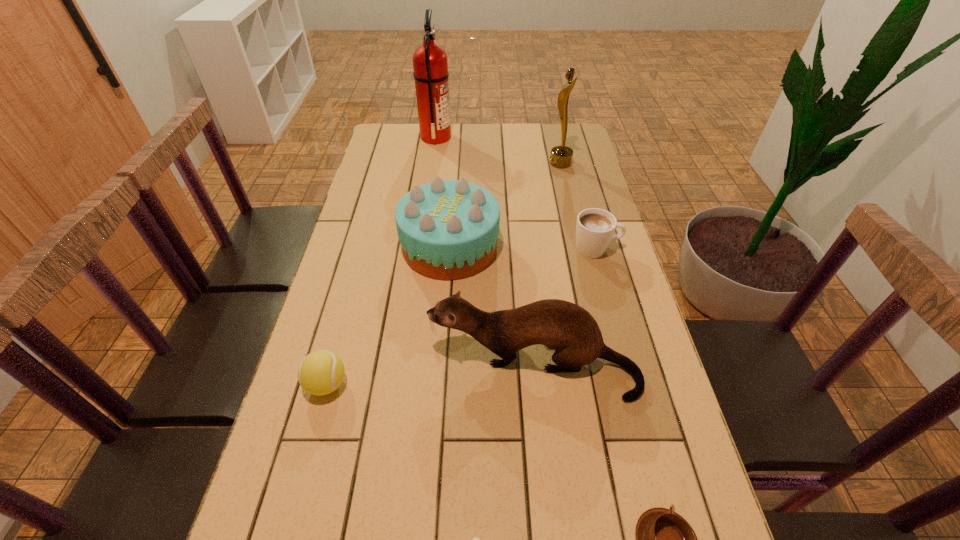
The width and height of the screenshot is (960, 540). Find the location of `free point located at the nozzle of the farthest object`. free point located at the nozzle of the farthest object is located at coordinates (541, 137).

Identify the location of free spot located 0.090m on the front-facing side of the seventh nearest object. (525, 163).

The image size is (960, 540). Find the location of `free location located on the front-facing side of the seventh nearest object`. free location located on the front-facing side of the seventh nearest object is located at coordinates (488, 163).

Locate an element on the screen. Image resolution: width=960 pixels, height=540 pixels. vacant space positioned on the front-facing side of the seventh nearest object is located at coordinates (509, 163).

At what (x,y) coordinates should I click in order to perform the action: click on vacant space located 0.150m on the back of the cake. Please return your answer as a coordinate pair (x, y). The height and width of the screenshot is (540, 960). Looking at the image, I should click on (454, 190).

At what (x,y) coordinates should I click in order to perform the action: click on free space located 0.210m at the face of the ferret. Please return your answer as a coordinate pair (x, y). This screenshot has height=540, width=960. Looking at the image, I should click on (340, 366).

This screenshot has height=540, width=960. In order to click on vacant space positioned at the face of the ferret in this screenshot , I will do `click(348, 366)`.

I want to click on free spot located 0.220m at the face of the ferret, so click(335, 366).

The image size is (960, 540). I want to click on vacant space located on the right of the leftmost object, so click(x=472, y=384).

Find the location of a particular element. The height and width of the screenshot is (540, 960). object that is at the far edge is located at coordinates (430, 65).